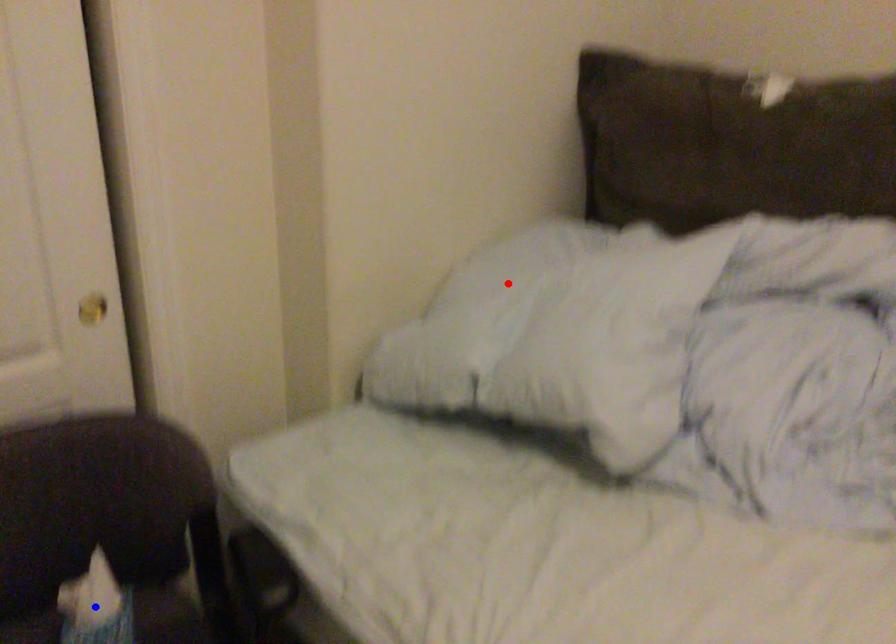
Question: Which of the two points in the image is closer to the camera?

Choices:
 (A) Blue point is closer.
 (B) Red point is closer.

Answer: (A)